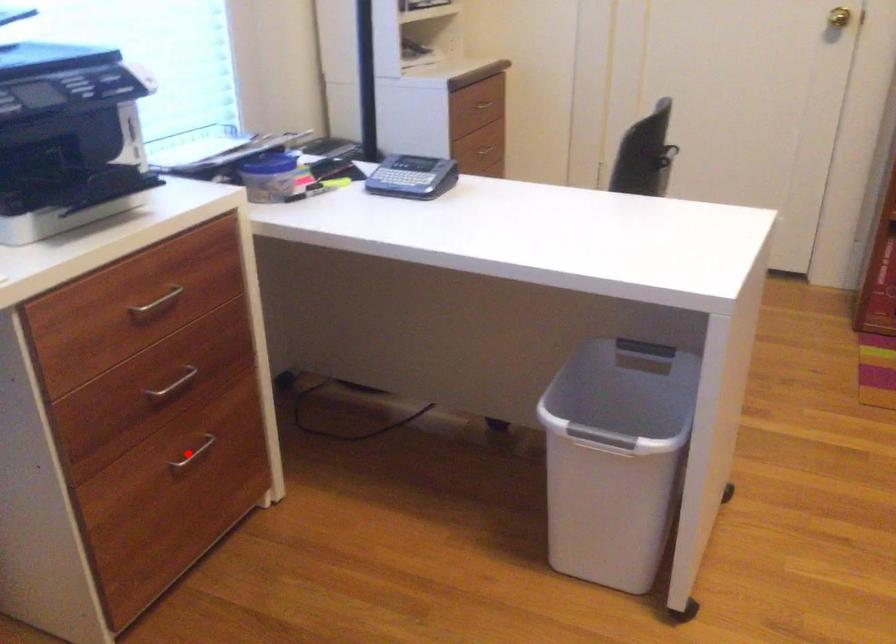
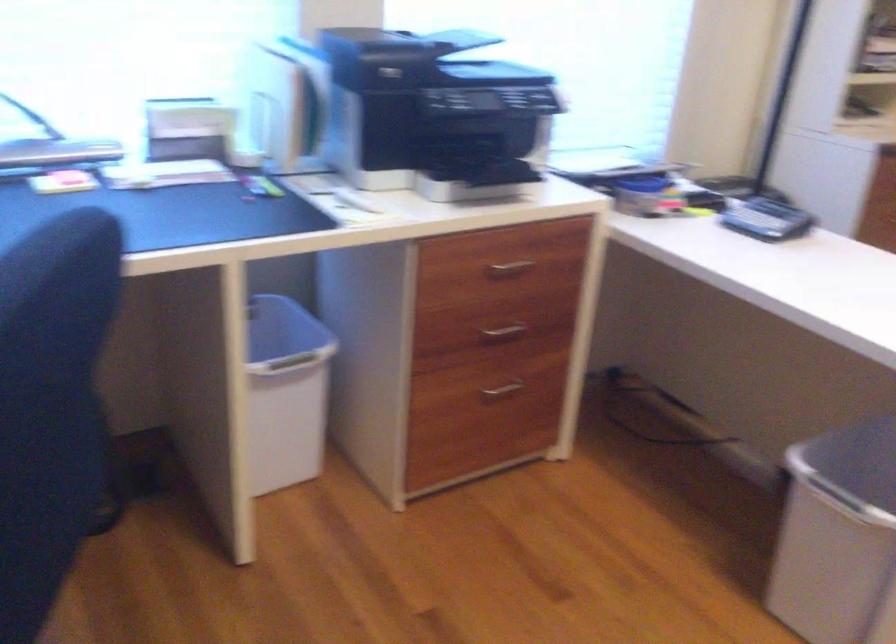
In the second image, find the point that corresponds to the highlighted location in the first image.

(501, 388)